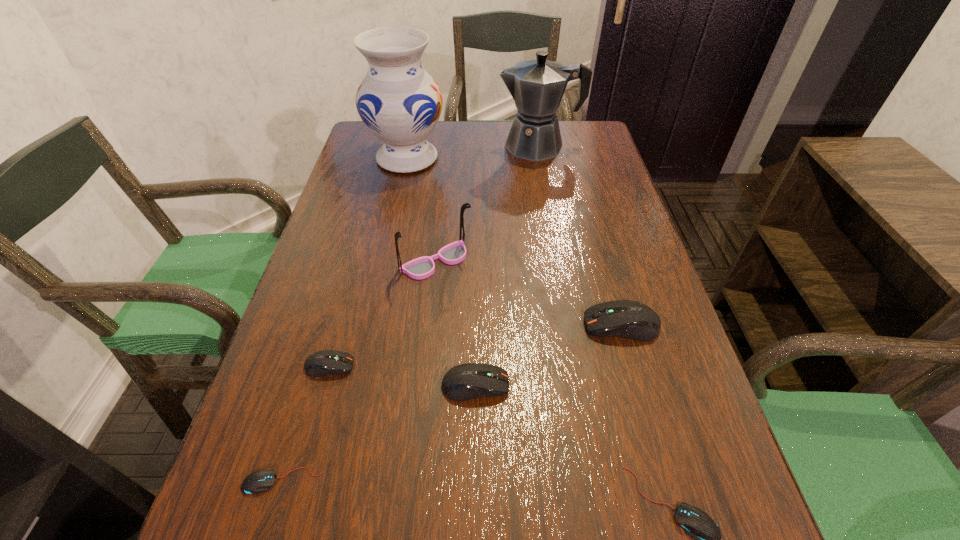
Find the location of `red vase`. red vase is located at coordinates (399, 102).

At what (x,y) coordinates should I click in order to perform the action: click on vase. Please return your answer as a coordinate pair (x, y). Image resolution: width=960 pixels, height=540 pixels. Looking at the image, I should click on [399, 102].

At what (x,y) coordinates should I click in order to perform the action: click on coffeepot. Please return your answer as a coordinate pair (x, y). The height and width of the screenshot is (540, 960). Looking at the image, I should click on (537, 86).

Identify the location of pink spectacles. (420, 268).

Locate an element on the screen. The width and height of the screenshot is (960, 540). the third farthest object is located at coordinates (420, 268).

You are a GUI agent. You are given a task and a screenshot of the screen. Output one action in this format:
    pyautogui.click(x=<x>, y=<y>)
    Task: Click on the rightmost dark computer equipment
    The image size is (960, 540).
    Given the screenshot: What is the action you would take?
    pyautogui.click(x=629, y=319)

You are a GUI agent. You are given a task and a screenshot of the screen. Output one action in this format:
    pyautogui.click(x=<x>, y=<y>)
    Task: Click on the biggest dark computer equipment
    Image resolution: width=960 pixels, height=540 pixels.
    Given the screenshot: What is the action you would take?
    pyautogui.click(x=629, y=319)

At what (x,y) coordinates should I click in order to perform the action: click on the fifth tallest object. Please return your answer as a coordinate pair (x, y). Looking at the image, I should click on (467, 381).

You are a GUI agent. You are given a task and a screenshot of the screen. Output one action in this format:
    pyautogui.click(x=<x>, y=<y>)
    Task: Click on the second tallest mouse
    This screenshot has height=540, width=960.
    Given the screenshot: What is the action you would take?
    pyautogui.click(x=467, y=381)

This screenshot has width=960, height=540. Find the location of `the smallest dark computer equipment`. the smallest dark computer equipment is located at coordinates (325, 362).